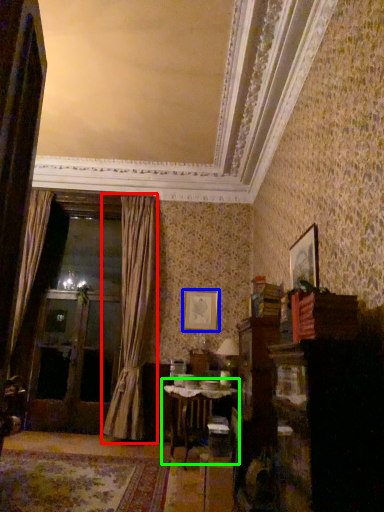
Question: Which object is the closest to the curtain (highlighted by a red box)? Choose among these: picture frame (highlighted by a blue box) or table (highlighted by a green box).

Choices:
 (A) picture frame
 (B) table

Answer: (A)